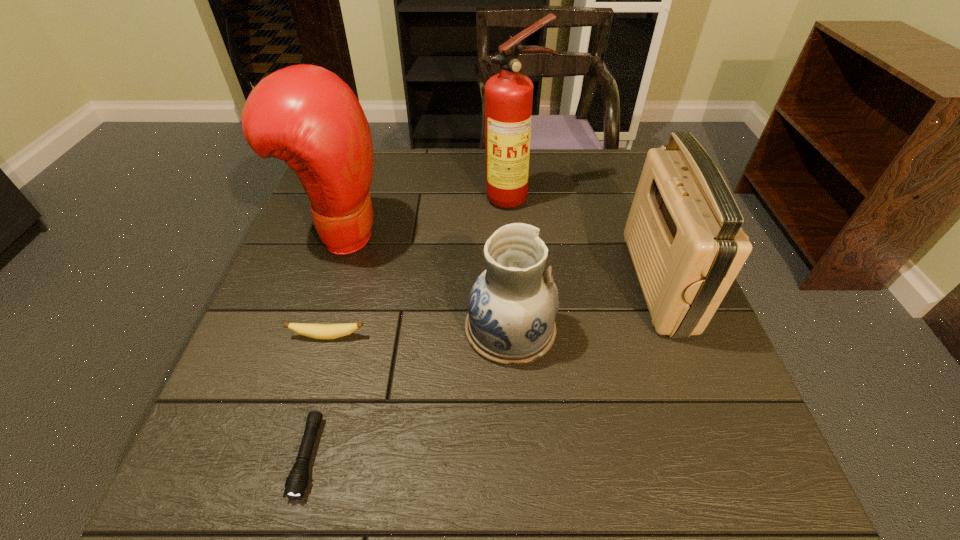
The image size is (960, 540). In the image, there is a desktop. What are the coordinates of `free space at the far edge` in the screenshot? It's located at (543, 194).

The width and height of the screenshot is (960, 540). I want to click on free space at the near edge of the desktop, so click(x=659, y=498).

This screenshot has width=960, height=540. In the image, there is a desktop. In order to click on free space at the right edge in this screenshot , I will do `click(637, 306)`.

In the image, there is a desktop. At what (x,y) coordinates should I click in order to perform the action: click on vacant space at the far right corner. Please return your answer as a coordinate pair (x, y). The width and height of the screenshot is (960, 540). Looking at the image, I should click on (636, 166).

The image size is (960, 540). In the image, there is a desktop. Find the location of `free space at the near right corner`. free space at the near right corner is located at coordinates (754, 488).

At what (x,y) coordinates should I click in order to perform the action: click on empty location between the fourth shortest object and the flashlight. Please return your answer as a coordinate pair (x, y). The width and height of the screenshot is (960, 540). Looking at the image, I should click on (483, 369).

Image resolution: width=960 pixels, height=540 pixels. What are the coordinates of `free space that is in between the fire extinguisher and the boxing glove` in the screenshot? It's located at (427, 216).

Where is `empty location between the fire extinguisher and the fifth tallest object`? empty location between the fire extinguisher and the fifth tallest object is located at coordinates (420, 267).

Image resolution: width=960 pixels, height=540 pixels. In order to click on empty location between the third shortest object and the second shortest object in this screenshot , I will do `click(419, 333)`.

Find the location of a particular element. unoccupied position between the fire extinguisher and the boxing glove is located at coordinates (427, 216).